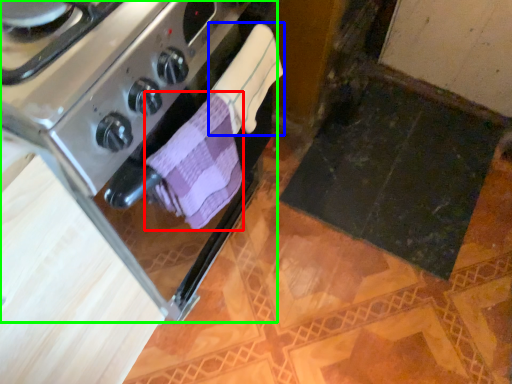
Question: Which object is the farthest from bath towel (highlighted by a red box)? Choose among these: bath towel (highlighted by a blue box) or kitchen appliance (highlighted by a green box).

Choices:
 (A) bath towel
 (B) kitchen appliance

Answer: (B)